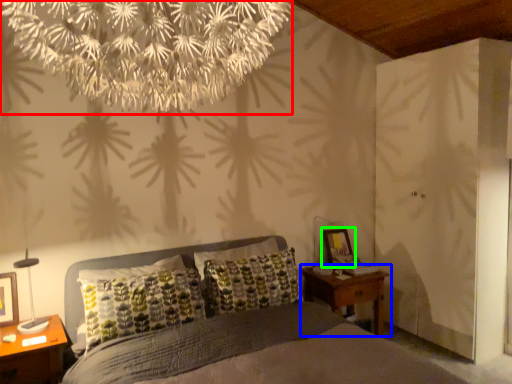
Question: Which object is positioned closest to flower (highlighted by a red box)? Select from nightstand (highlighted by a blue box) and picture frame (highlighted by a green box).

Choices:
 (A) nightstand
 (B) picture frame

Answer: (A)